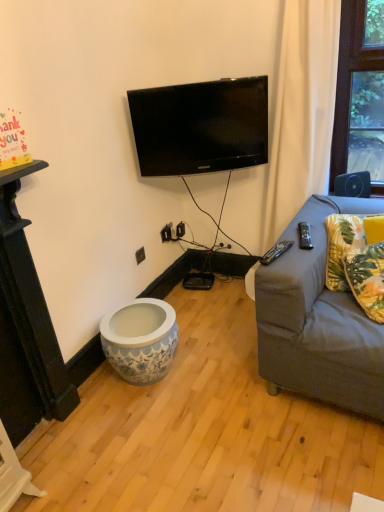
Question: Does point (334, 252) appear closer or farther from the camera than point (173, 114)?

Choices:
 (A) closer
 (B) farther

Answer: (A)

Question: Which is correct: yellow fabric pillow at right, the 1th pillow from the back, is inside black glossy tv at upper center, or outside of it?

Choices:
 (A) outside
 (B) inside

Answer: (A)

Question: Estimate the real-world distances between objects in this image. Which object is farther from the black plastic remote control at right, the first remote control viewed from the right?

Choices:
 (A) black plastic outlet at lower center
 (B) yellow fabric pillow at right, the second pillow viewed from the front
 (C) black glossy tv at upper center
 (D) yellow floral fabric pillow at right, arranged as the first pillow when viewed from the front
 (E) black plastic remote control at right, which is the second remote control from right to left

Answer: (A)

Question: Which is farther from the yellow fabric pillow at right, the second pillow viewed from the front?

Choices:
 (A) yellow floral fabric pillow at right, arranged as the first pillow when viewed from the front
 (B) black glossy tv at upper center
 (C) black plastic remote control at right, which is the first remote control from left to right
 (D) black plastic remote control at right, the first remote control viewed from the right
 (E) black plastic outlet at lower center

Answer: (E)